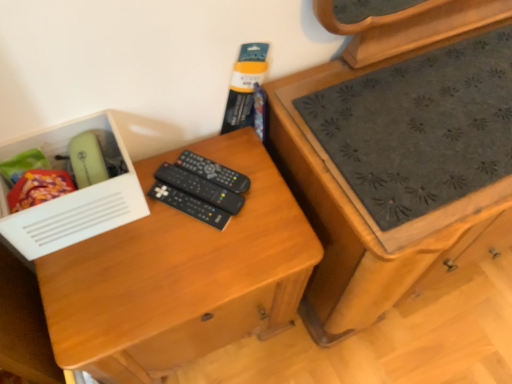
Identify the location of empty space that is ontop of wooden chest of drawers at right (from a real-world perspective). (436, 115).